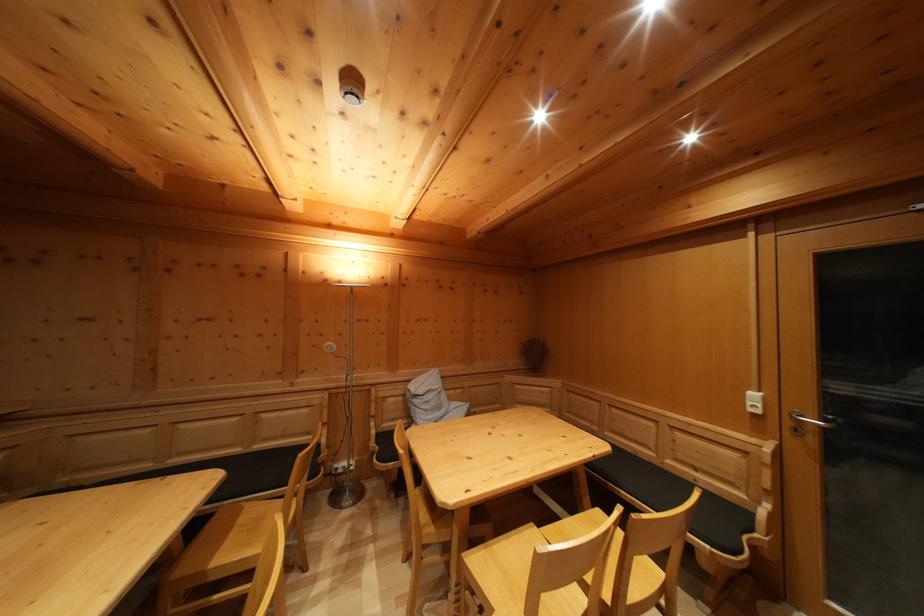
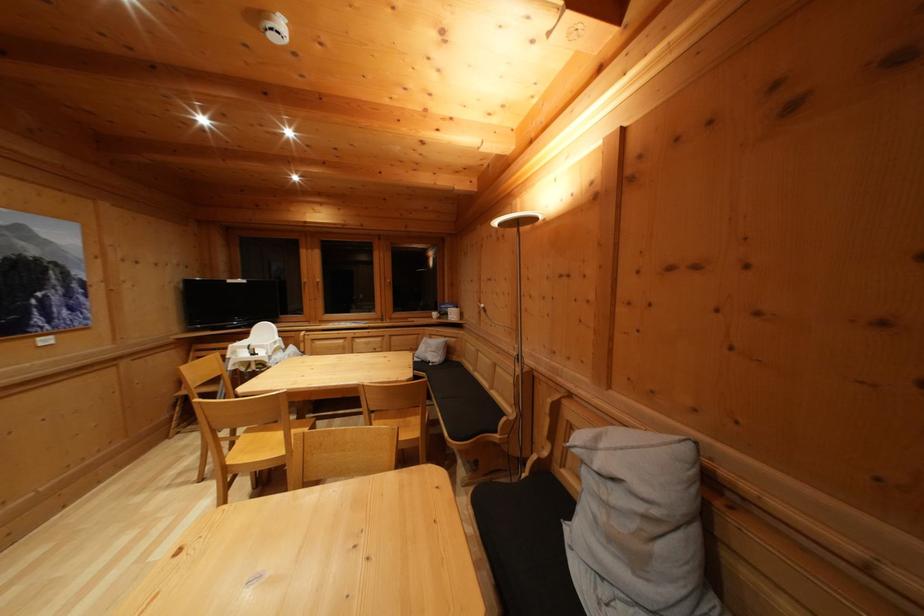
In the second image, find the point that corresponds to (444,415) in the first image.

(640, 565)